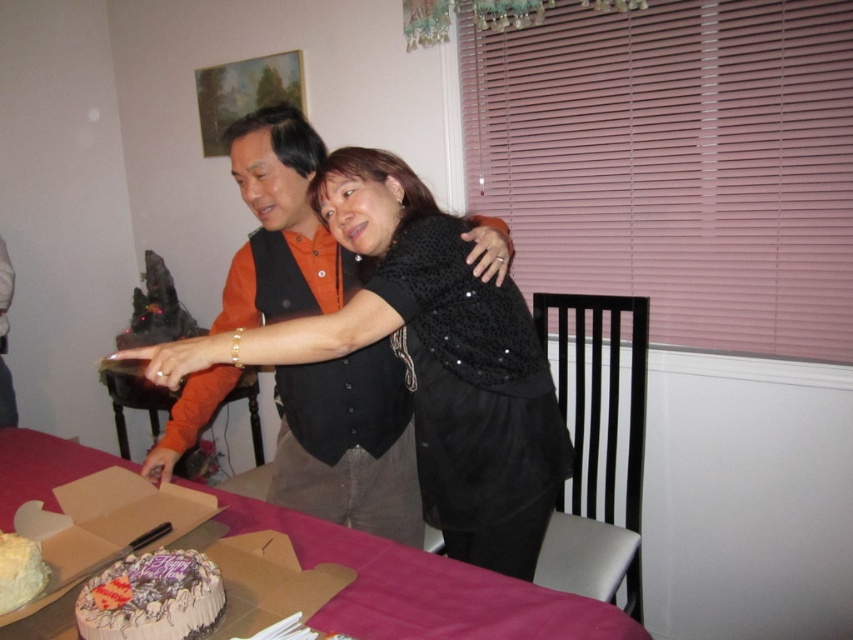
Which is below, chocolate frosted cake at center or white frosted cake at lower left?

chocolate frosted cake at center is below.

How far apart are chocolate frosted cake at center and white frosted cake at lower left?

The distance of chocolate frosted cake at center from white frosted cake at lower left is 7.24 inches.

This screenshot has width=853, height=640. I want to click on chocolate frosted cake at center, so click(151, 596).

Is point (287, 330) positioned behind point (38, 545)?

Yes, it is.

Who is positioned more to the left, black sequined dress at center or white frosted cake at lower left?

Positioned to the left is white frosted cake at lower left.

Does point (440, 328) come closer to viewer compared to point (4, 612)?

That is False.

This screenshot has width=853, height=640. I want to click on black sequined dress at center, so click(x=426, y=358).

Is pink fabric table at center to the left of white frosted cake at lower left from the viewer's perspective?

No, pink fabric table at center is not to the left of white frosted cake at lower left.

Looking at this image, how far apart are pink fabric table at center and white frosted cake at lower left?

A distance of 17.45 inches exists between pink fabric table at center and white frosted cake at lower left.

This screenshot has width=853, height=640. Identify the location of pink fabric table at center. (422, 588).